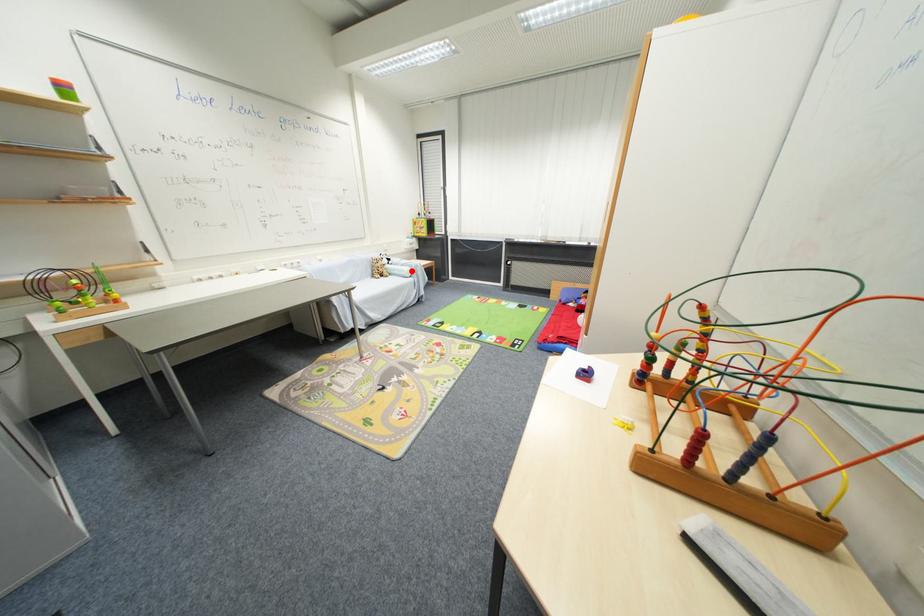
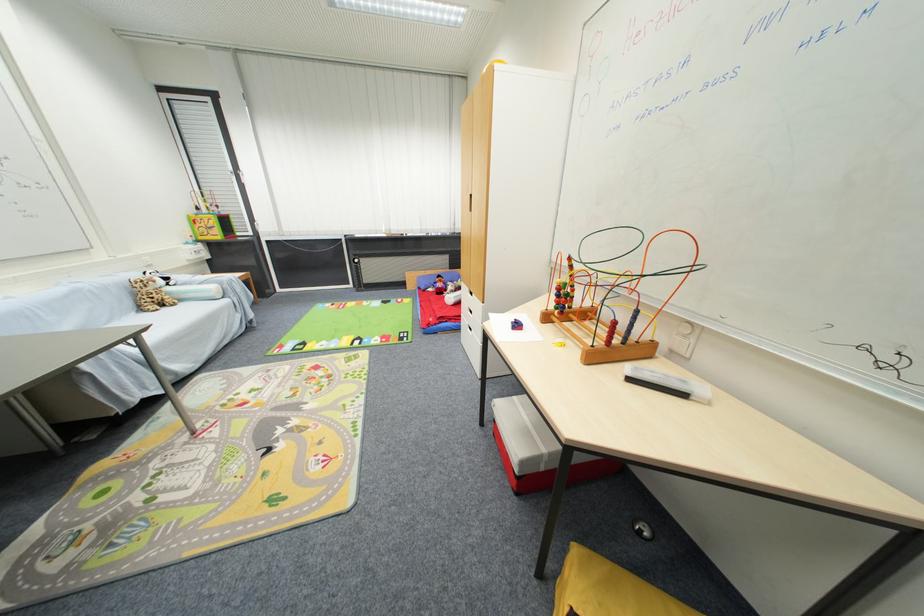
The point at the highlighted location is marked in the first image. Where is the corresponding point in the second image?

(217, 290)